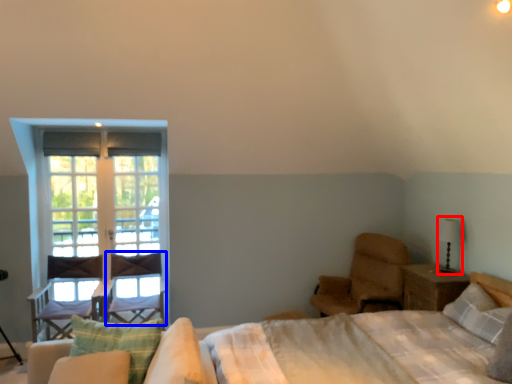
Question: Among these objects, which one is nearest to the camera, table lamp (highlighted by a red box) or swivel chair (highlighted by a blue box)?

Choices:
 (A) table lamp
 (B) swivel chair

Answer: (A)